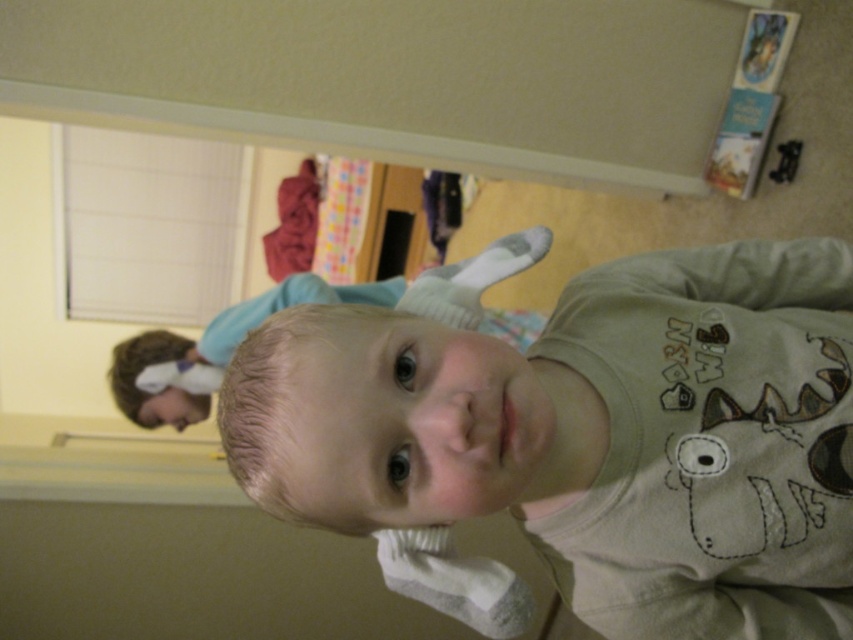
You are a photographer setting up for a family portrait. You notice the light brown cotton shirt at center and the smooth beige baby at center in the scene. Which object is positioned lower in the image?

The light brown cotton shirt at center is located below the smooth beige baby at center, so it is positioned lower in the image.

From the picture: The child is wearing a light brown cotton shirt at center and there is a smooth beige baby at center. Which object is thinner?

The light brown cotton shirt at center is thinner than the smooth beige baby at center.